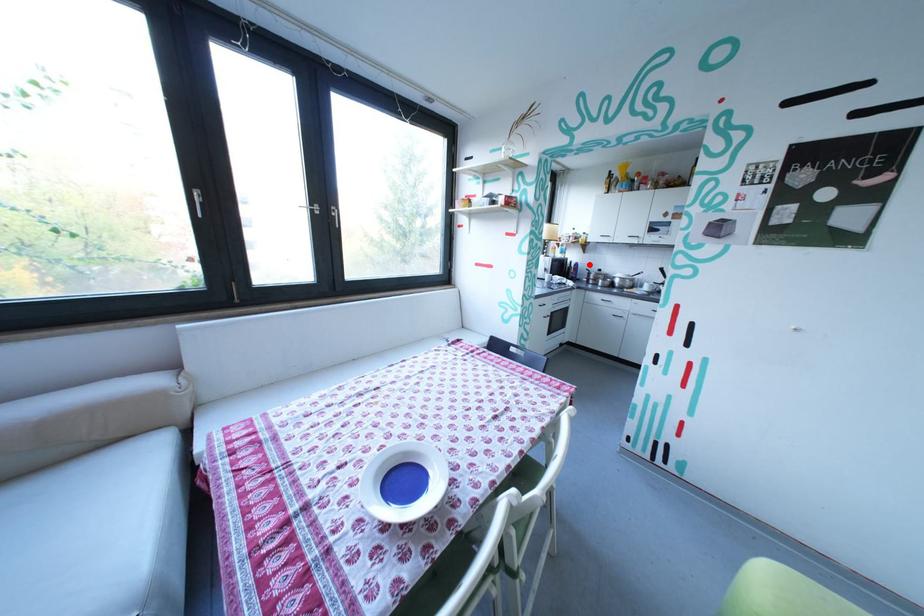
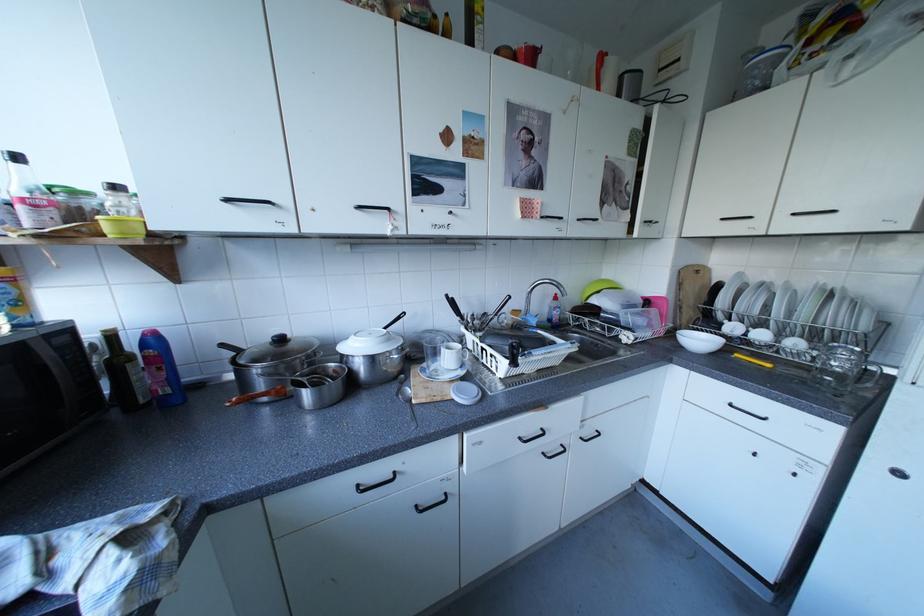
Locate, in the second image, the point that corresponds to the highlighted location in the first image.

(165, 339)